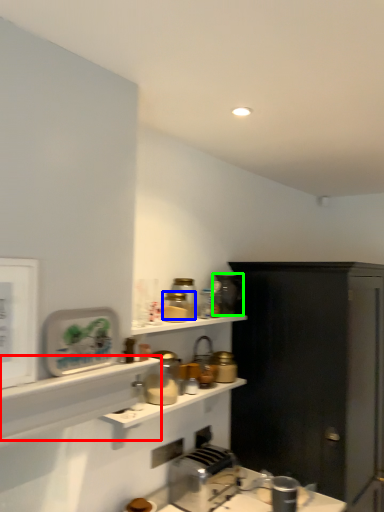
Question: Which object is positioned farthest from shelf (highlighted by a red box)? Select from appliance (highlighted by a blue box) and appliance (highlighted by a green box).

Choices:
 (A) appliance
 (B) appliance

Answer: (B)